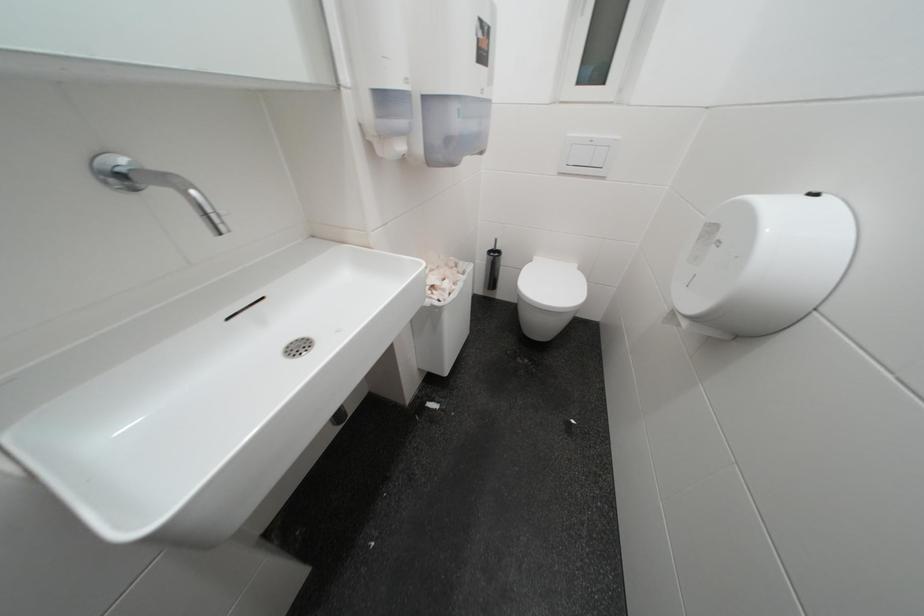
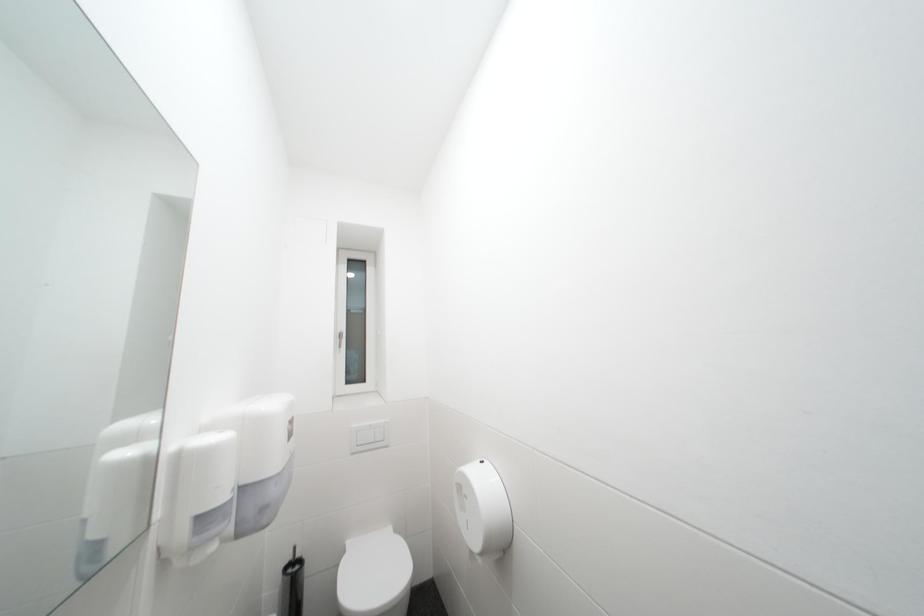
The images are taken continuously from a first-person perspective. In which direction is your viewpoint rotating?

The camera rotated toward right-up.